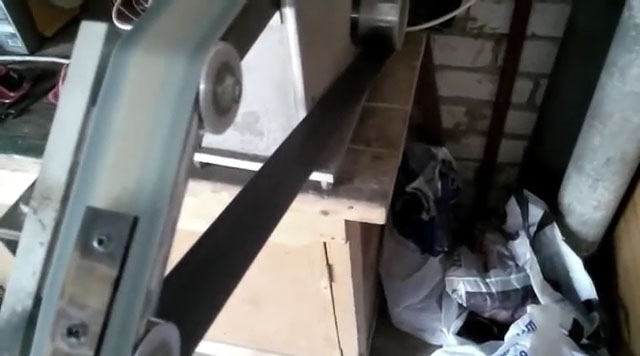
Locate an element on the screen. cord is located at coordinates (427, 21).